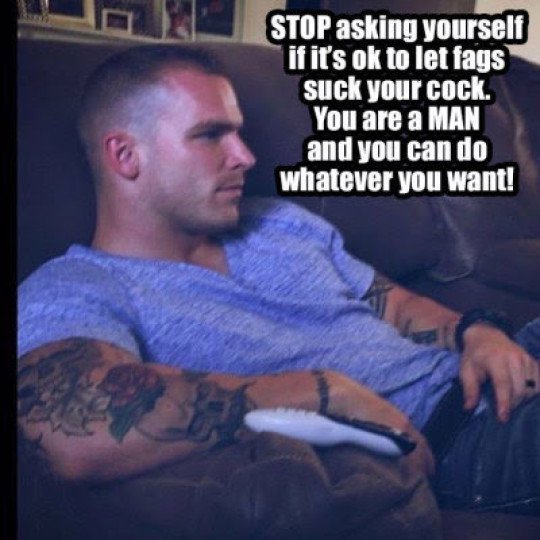
Image resolution: width=540 pixels, height=540 pixels. I want to click on couch, so click(55, 174).